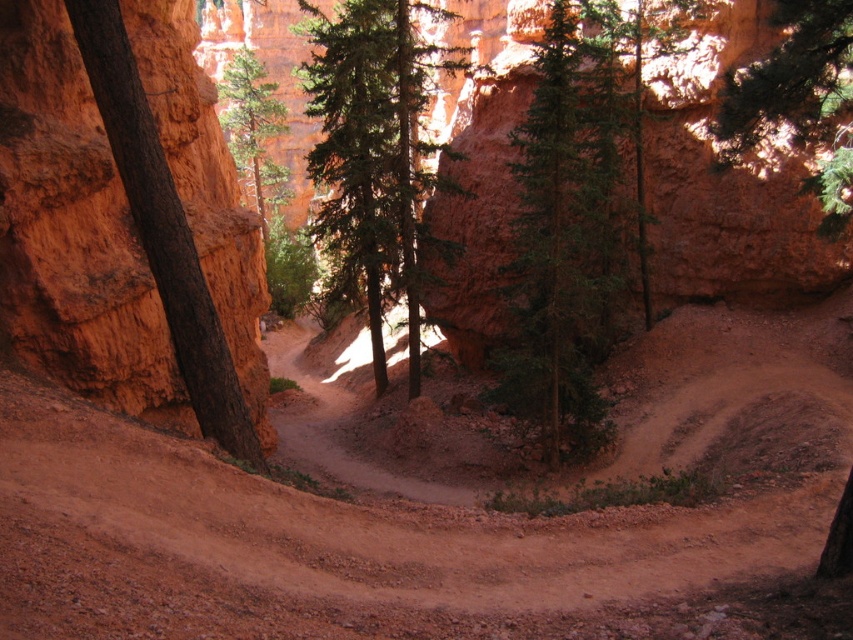
Question: Can you confirm if dusty brown dirt track at center is bigger than green matte tree at center?

Choices:
 (A) yes
 (B) no

Answer: (A)

Question: Which point appears closest to the camera in this image?

Choices:
 (A) (579, 74)
 (B) (395, 67)
 (C) (149, 230)
 (D) (32, 444)

Answer: (D)

Question: Does dusty brown dirt track at center lie in front of green textured pine tree at upper right?

Choices:
 (A) no
 (B) yes

Answer: (B)

Question: Which object is the closest to the brown rough bark tree at left?

Choices:
 (A) green textured tree at center
 (B) dusty brown dirt track at center

Answer: (B)

Question: Among these points, which one is nearest to the camera?

Choices:
 (A) (535, 388)
 (B) (399, 596)
 (C) (199, 284)

Answer: (B)

Question: Is green textured tree at center positioned before brown rough bark tree at left?

Choices:
 (A) no
 (B) yes

Answer: (A)